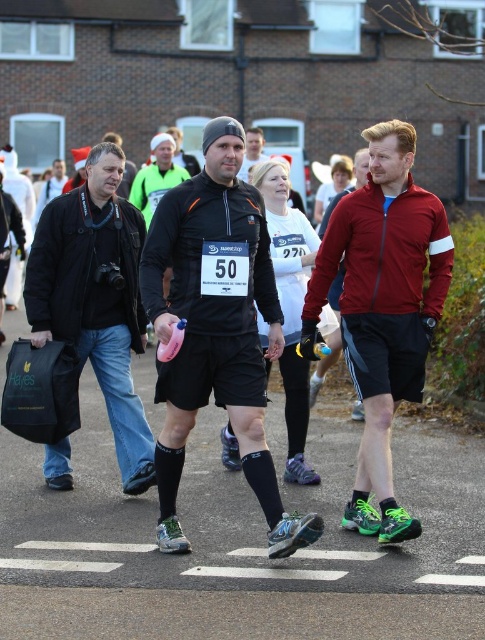
Which of these two, matte black shorts at center or black matte running shorts at center, stands shorter?

black matte running shorts at center is shorter.

Does matte black shorts at center have a larger size compared to black matte running shorts at center?

Yes, matte black shorts at center is bigger than black matte running shorts at center.

Between point (265, 275) and point (286, 282), which one is positioned behind?

The point (286, 282) is more distant.

You are a GUI agent. You are given a task and a screenshot of the screen. Output one action in this format:
    pyautogui.click(x=<x>, y=<y>)
    Task: Click on the matte black shorts at center
    This screenshot has width=485, height=640.
    Given the screenshot: What is the action you would take?
    pyautogui.click(x=215, y=330)

Where is `black matte jacket at left`? black matte jacket at left is located at coordinates (97, 298).

Who is taller, black matte jacket at left or black matte running shorts at center?

Standing taller between the two is black matte jacket at left.

Image resolution: width=485 pixels, height=640 pixels. Find the location of `black matte jacket at left`. black matte jacket at left is located at coordinates (97, 298).

Identify the location of black matte jacket at left. This screenshot has height=640, width=485. (97, 298).

Which of these two, matte red jacket at center or white asphalt at center, stands shorter?

white asphalt at center is shorter.

Which of these two, matte red jacket at center or white asphalt at center, stands taller?

With more height is matte red jacket at center.

Does point (380, 124) lie behind point (98, 564)?

Yes, it is.

This screenshot has width=485, height=640. Identify the location of matte red jacket at center. (383, 308).